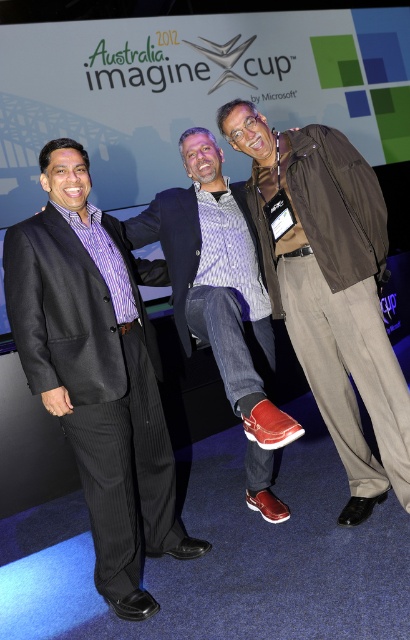
You are a photographer adjusting the camera focus. You need to focus on both the point at (x=346, y=388) and the point at (x=11, y=276). Which point is closer to the camera lens?

Point at (x=346, y=388) is closer to the camera lens because it is further to the viewer than point at (x=11, y=276).

You are a photographer at the Australia 2012 Imagine Cup event. You need to adjust the lighting to ensure both the black pinstripe suit at left and the matte black blazer at center are visible. Which object is closer to the camera, requiring more direct lighting?

The matte black blazer at center is closer to the camera than the black pinstripe suit at left, so it requires more direct lighting to ensure visibility.

In the scene shown: You are a photographer at the Australia 2012 Imagine Cup event. You need to place a small award plaque exactly at the center of the image. The plaque is 5 cm wide. The brown leather jacket at center is located at coordinates 0.456, 0.810. Can you place the plaque so that it doesn not overlap with the jacket?

The brown leather jacket at center is located at coordinates (332, 291). Since the plaque needs to be placed at the exact center of the image, which is at coordinates (205, 320), the distance between the jacket and the center is sqrt of the squared differences in x and y coordinates. The distance is sqrt of 0.044 squared plus 0.31 squared. That distance is sqrt of 0.001936 plus 0.0961 equals sqrt of 0.098036 which is approximately 0.313. Since 0.313 is more than half the plaque width in normalized units, so